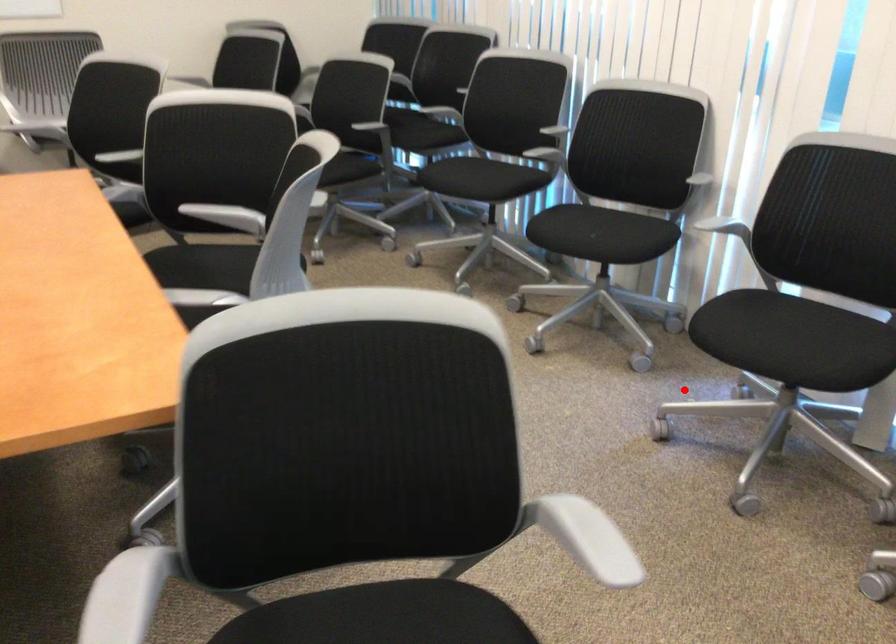
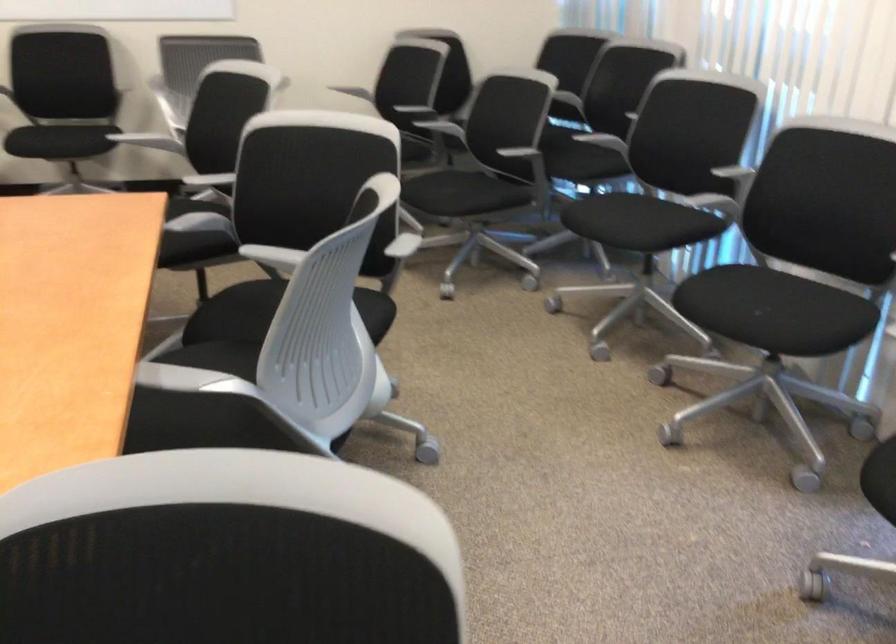
In the second image, find the point that corresponds to the highlighted location in the first image.

(858, 527)